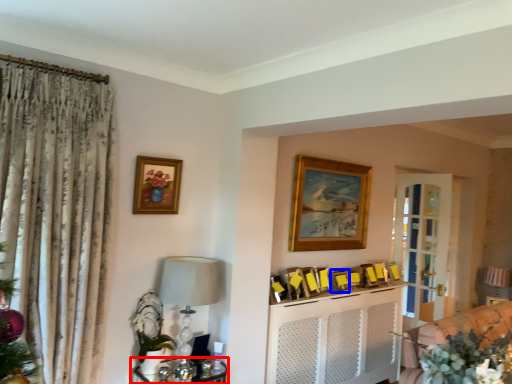
Question: Which object appears closest to the camera in this image, furniture (highlighted by a red box) or picture frame (highlighted by a blue box)?

Choices:
 (A) furniture
 (B) picture frame

Answer: (A)